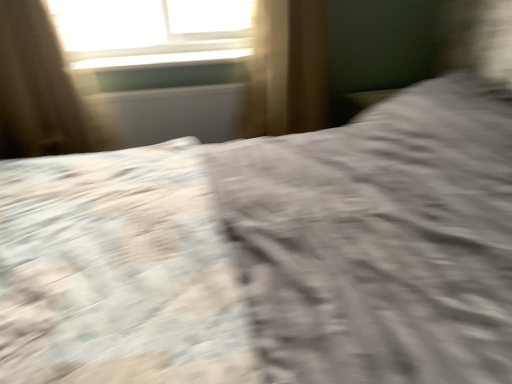
Question: Should I look upward or downward to see textured gray sheet at center?

Choices:
 (A) up
 (B) down

Answer: (B)

Question: Can you confirm if brown fabric curtain at upper left is positioned to the left of white glossy window sill at upper center?

Choices:
 (A) no
 (B) yes

Answer: (B)

Question: From a real-world perspective, is brown fabric curtain at upper left beneath white glossy window sill at upper center?

Choices:
 (A) no
 (B) yes

Answer: (B)

Question: Does brown fabric curtain at upper left have a lesser height compared to white glossy window sill at upper center?

Choices:
 (A) no
 (B) yes

Answer: (A)

Question: Are brown fabric curtain at upper left and white glossy window sill at upper center beside each other?

Choices:
 (A) yes
 (B) no

Answer: (B)

Question: From the image's perspective, is brown fabric curtain at upper left above white glossy window sill at upper center?

Choices:
 (A) yes
 (B) no

Answer: (B)

Question: Is white glossy window sill at upper center inside brown fabric curtain at upper left?

Choices:
 (A) yes
 (B) no

Answer: (B)

Question: Considering the relative positions of white glossy window sill at upper center and textured gray sheet at center in the image provided, is white glossy window sill at upper center in front of textured gray sheet at center?

Choices:
 (A) yes
 (B) no

Answer: (B)

Question: Does white glossy window sill at upper center have a lesser height compared to textured gray sheet at center?

Choices:
 (A) yes
 (B) no

Answer: (A)

Question: From the image's perspective, is white glossy window sill at upper center above textured gray sheet at center?

Choices:
 (A) yes
 (B) no

Answer: (A)

Question: Can you confirm if white glossy window sill at upper center is wider than textured gray sheet at center?

Choices:
 (A) yes
 (B) no

Answer: (B)

Question: Is white glossy window sill at upper center surrounding textured gray sheet at center?

Choices:
 (A) no
 (B) yes

Answer: (A)

Question: Is white glossy window sill at upper center oriented away from textured gray sheet at center?

Choices:
 (A) yes
 (B) no

Answer: (B)

Question: Can you confirm if textured gray sheet at center is smaller than white glossy window sill at upper center?

Choices:
 (A) no
 (B) yes

Answer: (A)